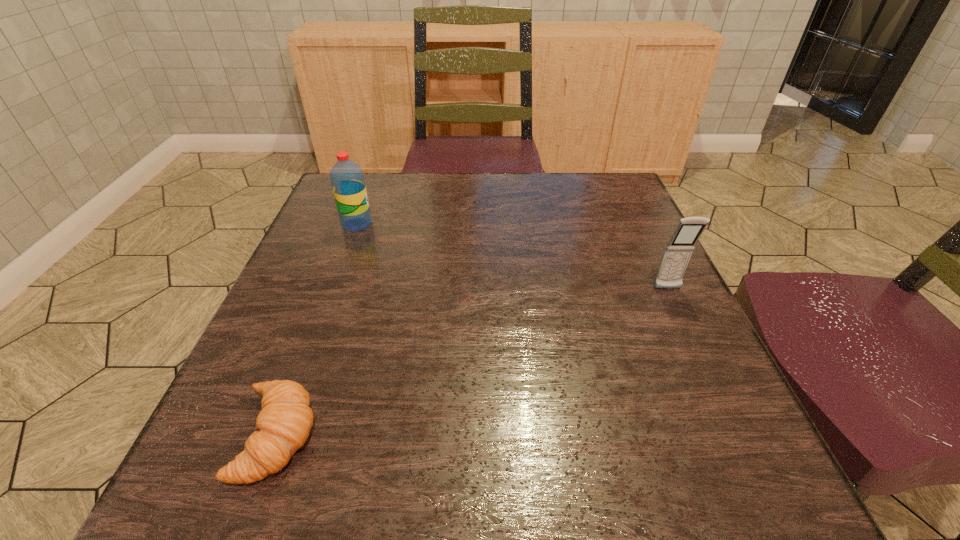
Where is `water bottle`? The height and width of the screenshot is (540, 960). water bottle is located at coordinates (347, 179).

You are a GUI agent. You are given a task and a screenshot of the screen. Output one action in this format:
    pyautogui.click(x=<x>, y=<y>)
    Task: Click on the rightmost object
    The width and height of the screenshot is (960, 540).
    Given the screenshot: What is the action you would take?
    pyautogui.click(x=678, y=251)

Locate an element on the screen. the second nearest object is located at coordinates (678, 251).

Identify the location of the shortest object. This screenshot has height=540, width=960. (284, 423).

What are the coordinates of `the nearest object` in the screenshot? It's located at (284, 423).

Find the location of a particular element. This screenshot has height=540, width=960. free space located 0.370m on the front label of the farthest object is located at coordinates (529, 224).

Locate an element on the screen. This screenshot has height=540, width=960. vacant space located 0.310m on the front-facing side of the second farthest object is located at coordinates (739, 441).

The height and width of the screenshot is (540, 960). Find the location of `vacant region located 0.400m on the back of the crescent roll`. vacant region located 0.400m on the back of the crescent roll is located at coordinates (350, 240).

Image resolution: width=960 pixels, height=540 pixels. Find the location of `object that is at the far edge`. object that is at the far edge is located at coordinates (347, 179).

I want to click on object located in the near edge section of the desktop, so click(284, 423).